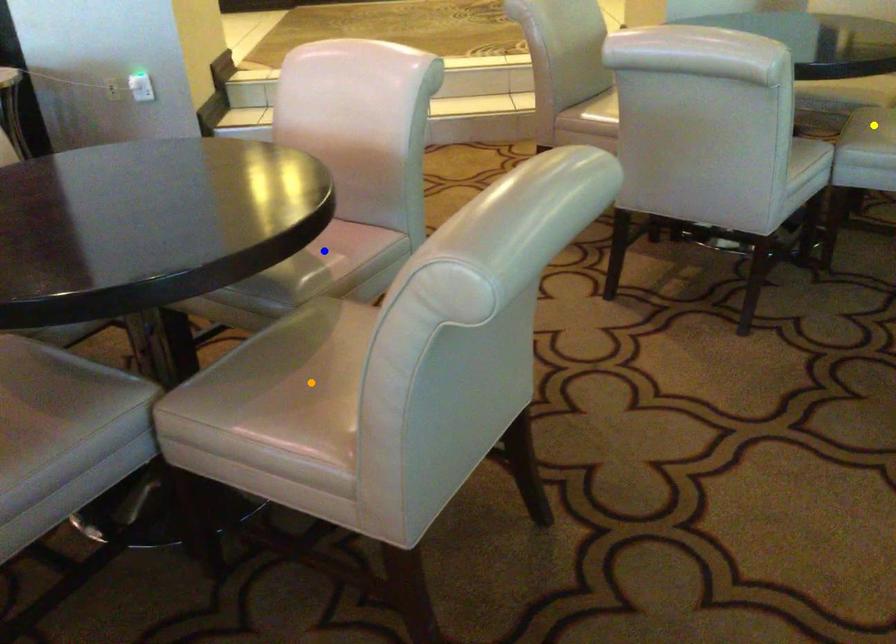
Order these from nearest to farthest:
yellow point, orange point, blue point

1. yellow point
2. blue point
3. orange point